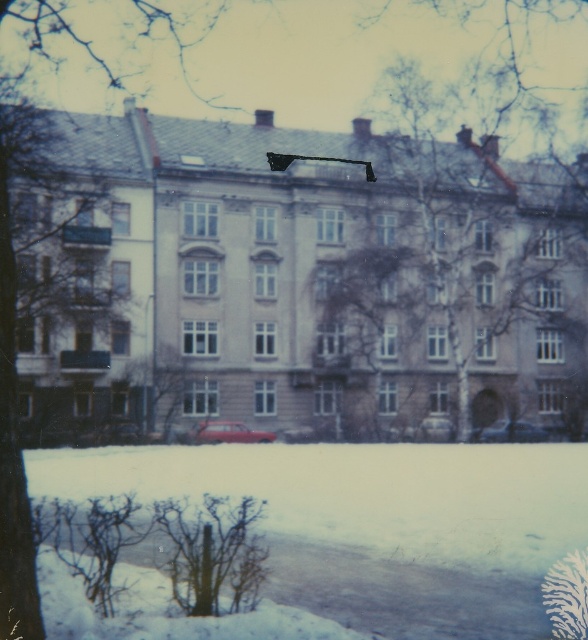
Identify the location of brown textured tree at center. (369, 339).

Looking at this image, which is below, brown textured tree at center or matte red car at lower center?

matte red car at lower center

Is point (382, 420) less distant than point (529, 436)?

No, (382, 420) is further to viewer.

Locate an element on the screen. This screenshot has height=640, width=588. brown textured tree at center is located at coordinates (369, 339).

Is matte red car at center to the right of matte red car at lower center from the viewer's perspective?

No, matte red car at center is not to the right of matte red car at lower center.

Does matte red car at center have a larger size compared to matte red car at lower center?

Incorrect, matte red car at center is not larger than matte red car at lower center.

What do you see at coordinates (228, 433) in the screenshot? The image size is (588, 640). I see `matte red car at center` at bounding box center [228, 433].

Image resolution: width=588 pixels, height=640 pixels. What are the coordinates of `matte red car at center` in the screenshot? It's located at (228, 433).

Can you confirm if white powdery snow at lower center is smaller than matte red car at lower center?

Incorrect, white powdery snow at lower center is not smaller in size than matte red car at lower center.

Between point (429, 620) and point (512, 436), which one is positioned in front?

Point (429, 620) is in front.

Locate an element on the screen. white powdery snow at lower center is located at coordinates (375, 522).

Where is `white powdery snow at lower center`? This screenshot has width=588, height=640. white powdery snow at lower center is located at coordinates (375, 522).